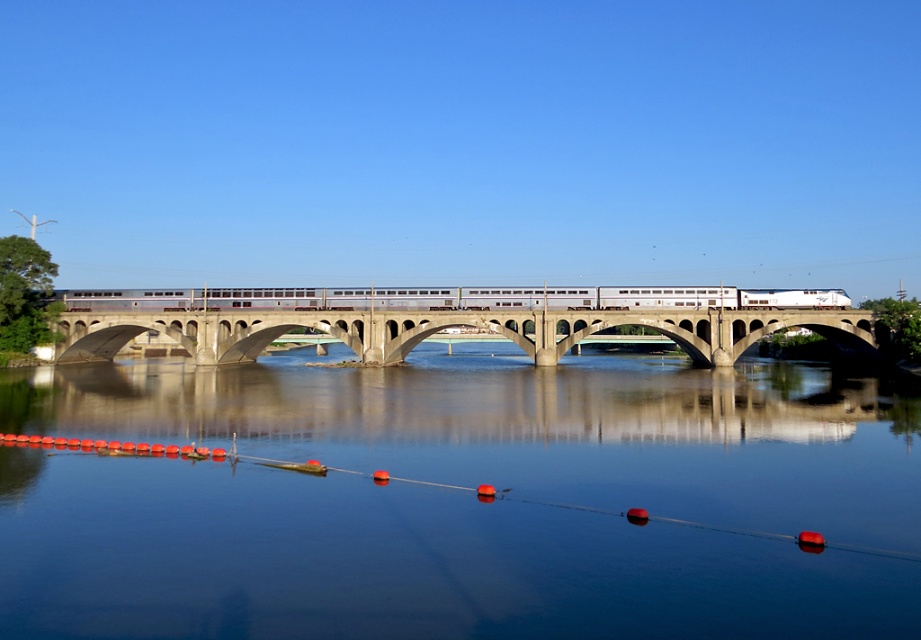
You are standing on the shore near the multi arched bridge. You see a point at coordinate (849, 435). If you want to reach that point, which direction should you move relative to the bridge?

The point at coordinate (849, 435) is 146.26 feet away from the viewer, so you should move towards the bridge to reach it.

Consider the image. You are a photographer planning to capture the entire scene of the smooth water at center and the silver metallic train at center. Given that your camera frame can only accommodate objects of the same size, which object should you adjust the focus on to ensure both fit within the frame?

Since the smooth water at center is smaller than the silver metallic train at center, you should adjust the focus on the silver metallic train at center to ensure both fit within the frame.

You are standing on the bridge and see two points marked on the bridge. The first point is at coordinate point (752, 432) and the second point is at coordinate point (663, 301). If you are facing the direction the train is moving, which point is closer to you?

Point (752, 432) is in front of point (663, 301), so if you are facing the direction the train is moving, the point closer to you would be point (752, 432).